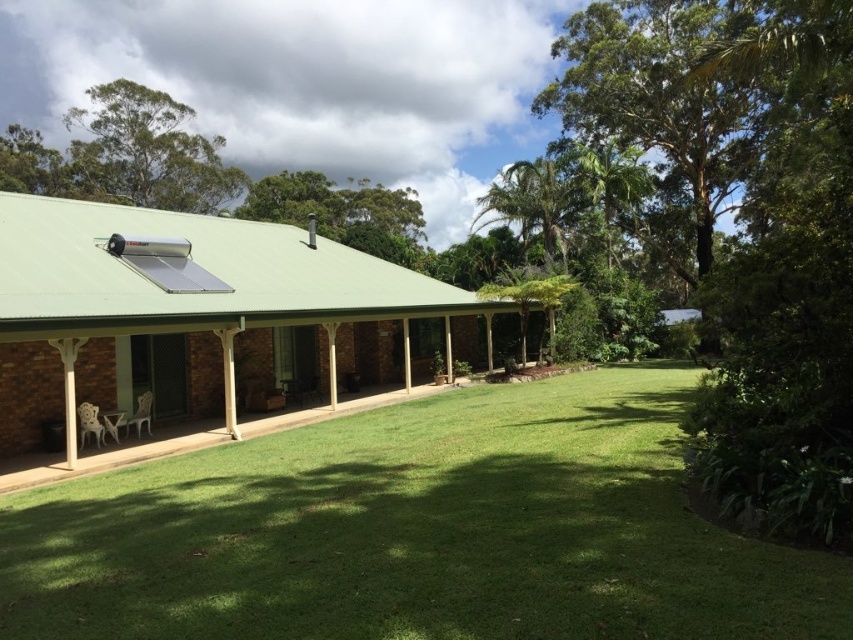
You are a gardener who wants to mow the green grass at center. However, there are white plastic chairs at lower left in the way. Can you mow the grass without moving the chairs?

The green grass at center is shorter than white plastic chairs at lower left, so the chairs are taller than the grass. Since the chairs are taller, you can mow the grass without moving them because the mower won not hit the chairs.

You are a visitor arriving at the house and see the green grass at center and the white plastic chairs at lower left. Which object is positioned more to the left side of the image?

The white plastic chairs at lower left are positioned more to the left side of the image compared to the green grass at center.